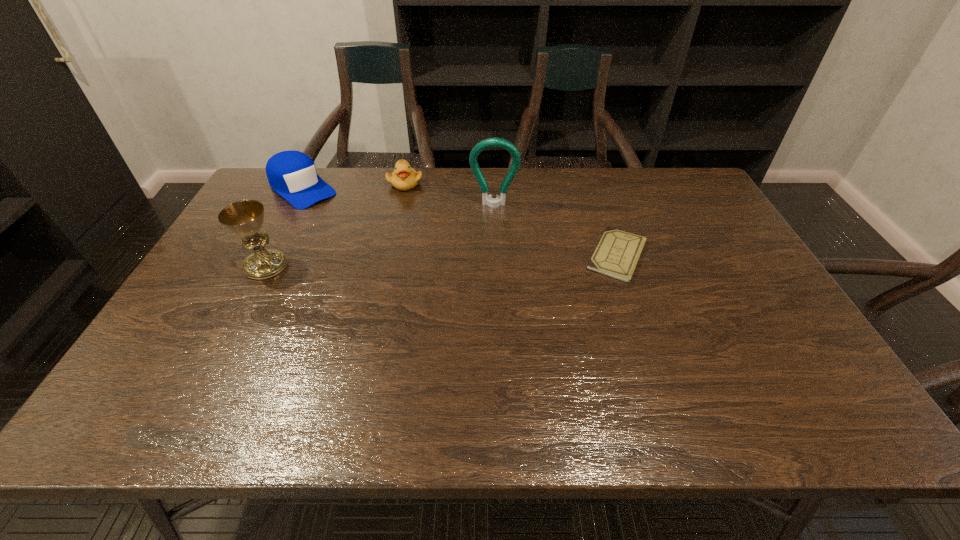
This screenshot has height=540, width=960. I want to click on vacant space located on the front-facing side of the fourth tallest object, so click(x=425, y=252).

Locate an element on the screen. vacant area situated 0.390m on the front-facing side of the fourth tallest object is located at coordinates (430, 268).

Where is `blank space located on the front-facing side of the fourth tallest object`? The width and height of the screenshot is (960, 540). blank space located on the front-facing side of the fourth tallest object is located at coordinates (415, 216).

At what (x,y) coordinates should I click in order to perform the action: click on vacant space located on the front-facing side of the third tallest object. Please return your answer as a coordinate pair (x, y). The width and height of the screenshot is (960, 540). Looking at the image, I should click on (382, 254).

Where is `vacant area located on the front-facing side of the third tallest object`? This screenshot has height=540, width=960. vacant area located on the front-facing side of the third tallest object is located at coordinates (387, 258).

Where is `free location located 0.340m on the front-facing side of the third tallest object`? free location located 0.340m on the front-facing side of the third tallest object is located at coordinates (380, 253).

At what (x,y) coordinates should I click in order to perform the action: click on vacant region located 0.070m at the jaws of the tallest object. Please return your answer as a coordinate pair (x, y). Looking at the image, I should click on (493, 224).

Where is `vacant space located at the jaws of the tallest object`? This screenshot has width=960, height=540. vacant space located at the jaws of the tallest object is located at coordinates (492, 268).

Identify the location of free space located at the jaws of the tallest object. (493, 230).

Locate an element on the screen. The width and height of the screenshot is (960, 540). duckling positioned at the far edge is located at coordinates (404, 178).